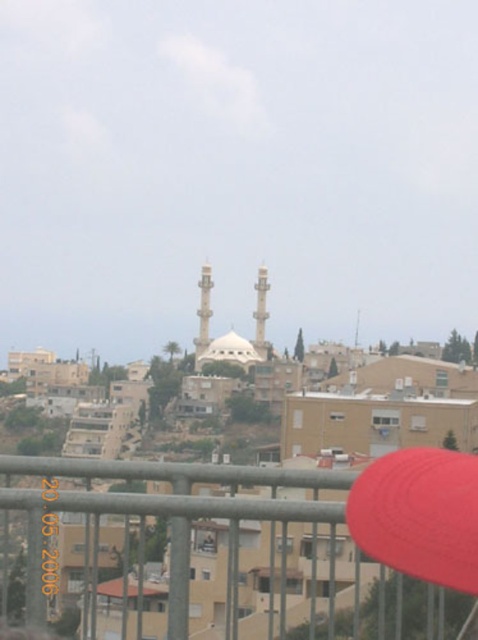
Question: Which of the following is the closest to the observer?

Choices:
 (A) (465, 496)
 (B) (42, 582)

Answer: (A)

Question: Can you confirm if metallic gray rail at lower center is positioned above red matte baseball hat at lower right?

Choices:
 (A) no
 (B) yes

Answer: (A)

Question: Among these points, which one is farthest from the camera?

Choices:
 (A) (178, 477)
 (B) (382, 504)

Answer: (A)

Question: Which point appears farthest from the camera in this image?

Choices:
 (A) (341, 556)
 (B) (441, 477)

Answer: (A)

Question: Does metallic gray rail at lower center appear under red matte baseball hat at lower right?

Choices:
 (A) no
 (B) yes

Answer: (B)

Question: Can you confirm if metallic gray rail at lower center is positioned to the right of red matte baseball hat at lower right?

Choices:
 (A) no
 (B) yes

Answer: (A)